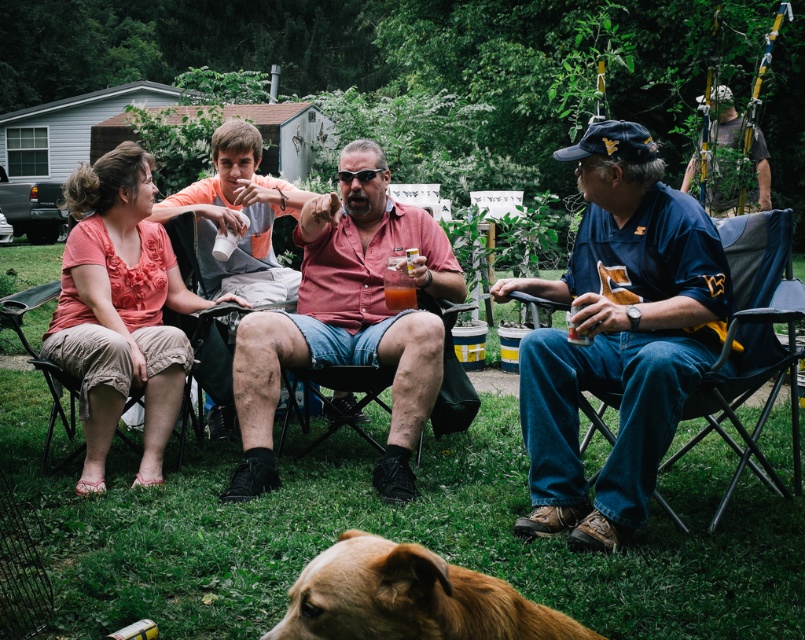
Question: Which object is positioned farthest from the reddish-brown shirt at center?

Choices:
 (A) camouflage fabric hat at upper right
 (B) translucent plastic cup at center

Answer: (A)

Question: Does beige fabric chair at lower left have a larger size compared to camouflage fabric hat at upper right?

Choices:
 (A) yes
 (B) no

Answer: (B)

Question: Which object is the closest to the translucent plastic cup at center?

Choices:
 (A) brown furry dog at lower center
 (B) camouflage fabric hat at upper right
 (C) blue denim shirt at right
 (D) matte orange shirt at center

Answer: (D)

Question: Does matte orange shirt at center appear over reddish-brown shirt at center?

Choices:
 (A) no
 (B) yes

Answer: (B)

Question: Estimate the real-world distances between objects in this image. Which object is farther from the brown furry dog at lower center?

Choices:
 (A) denim fabric chair at right
 (B) camouflage fabric hat at upper right
 (C) translucent plastic cup at center

Answer: (B)

Question: Is denim fabric chair at right above translucent plastic cup at center?

Choices:
 (A) no
 (B) yes

Answer: (A)